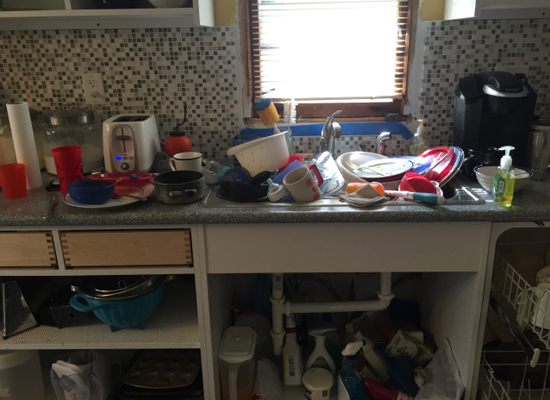
Look for where you would plug in an electrical appliance in the image and show me where they are. Your answer should be formatted as a list of tuples, i.e. [(x1, y1), (x2, y2), ...], where each tuple contains the x and y coordinates of a point satisfying the conditions above.

[(90, 85)]